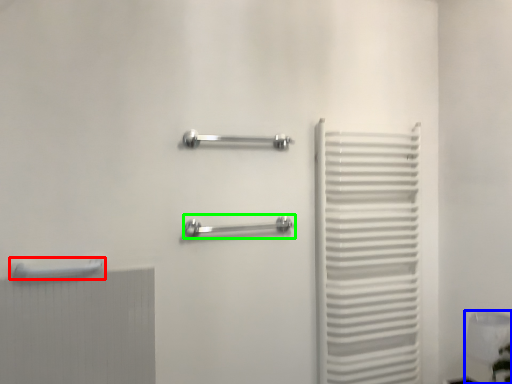
Question: Considering the real-world distances, which object is closest to towel rack (highlighted by a red box)? lamp (highlighted by a blue box) or towel rack (highlighted by a green box).

Choices:
 (A) lamp
 (B) towel rack

Answer: (B)